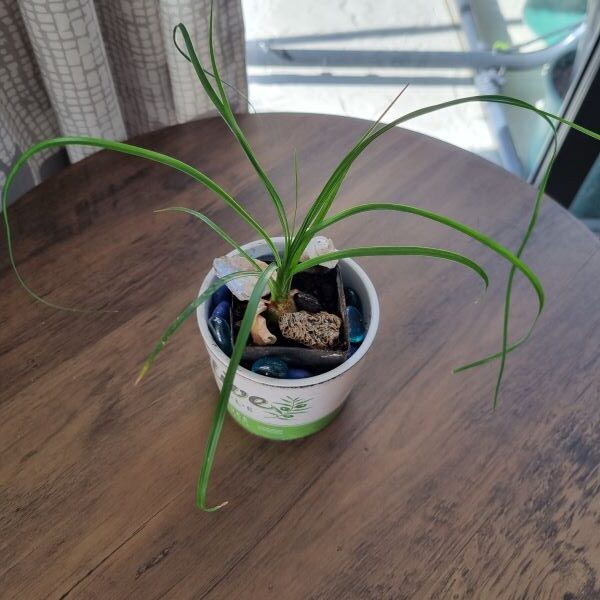
Find the location of `curtain`. curtain is located at coordinates (116, 72).